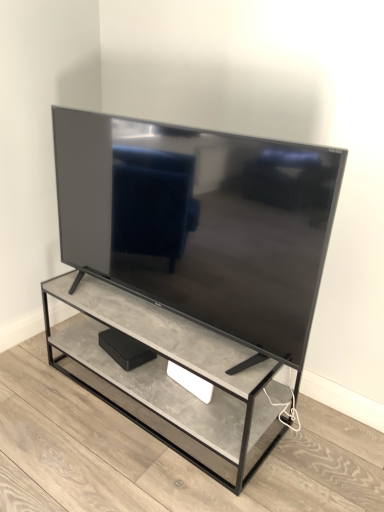
What do you see at coordinates (170, 380) in the screenshot? I see `concrete/metal shelf at center` at bounding box center [170, 380].

Where is `concrete/metal shelf at center`? The image size is (384, 512). concrete/metal shelf at center is located at coordinates (170, 380).

At what (x,y) coordinates should I click in order to perform the action: click on concrete/metal shelf at center. Please return your answer as a coordinate pair (x, y). This screenshot has width=384, height=512. Looking at the image, I should click on (170, 380).